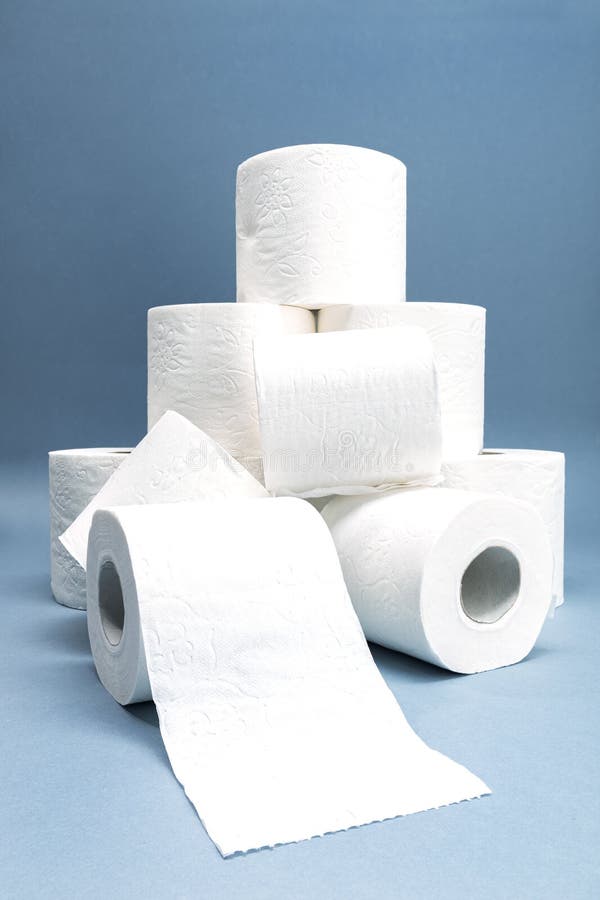
Where is `toilet paper roll`? This screenshot has width=600, height=900. toilet paper roll is located at coordinates (219, 591), (161, 477), (69, 488), (210, 381), (316, 410), (417, 582), (502, 492), (320, 501), (448, 344), (326, 257).